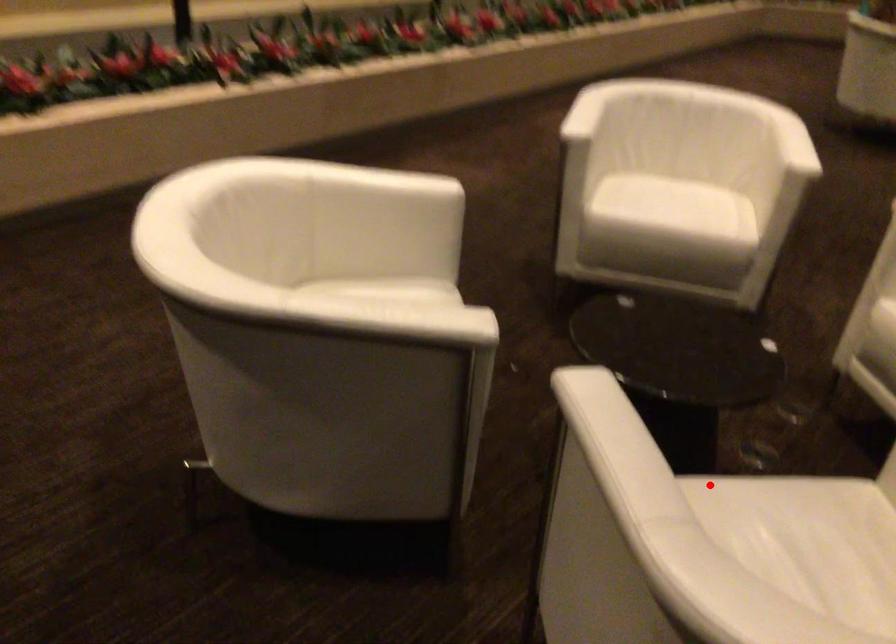
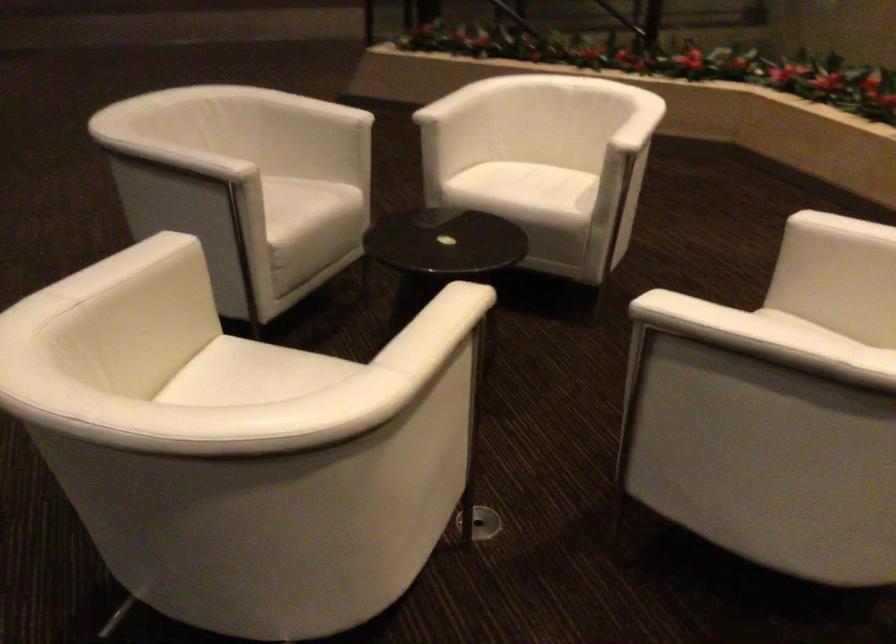
Question: I am providing you with two images of the same scene from different viewpoints. Image1 has a red point marked. In image2, the corresponding 3D location appears at what relative position? Reply with the corresponding letter.

Choices:
 (A) Closer
 (B) Farther

Answer: (B)